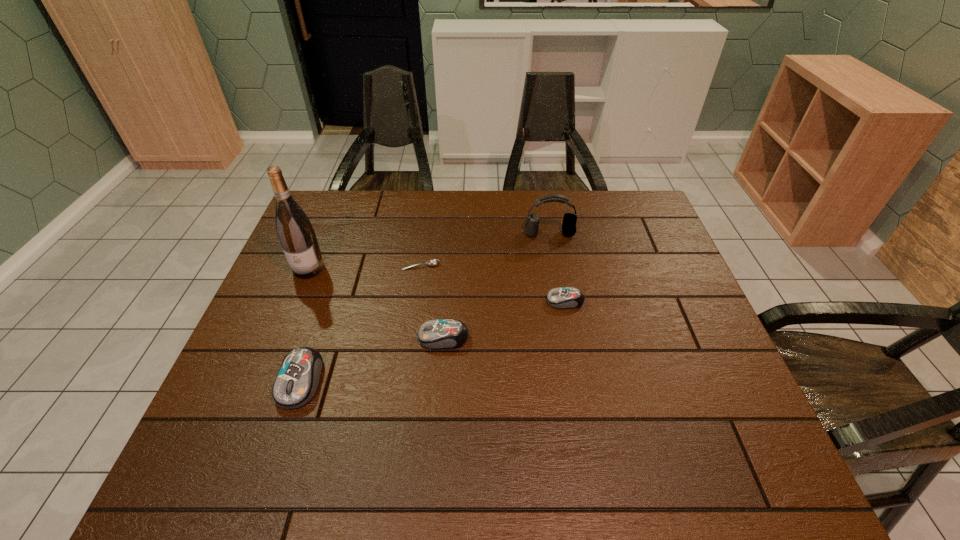
Locate an element on the screen. The height and width of the screenshot is (540, 960). vacant place for an extra computer mouse on the right is located at coordinates (669, 269).